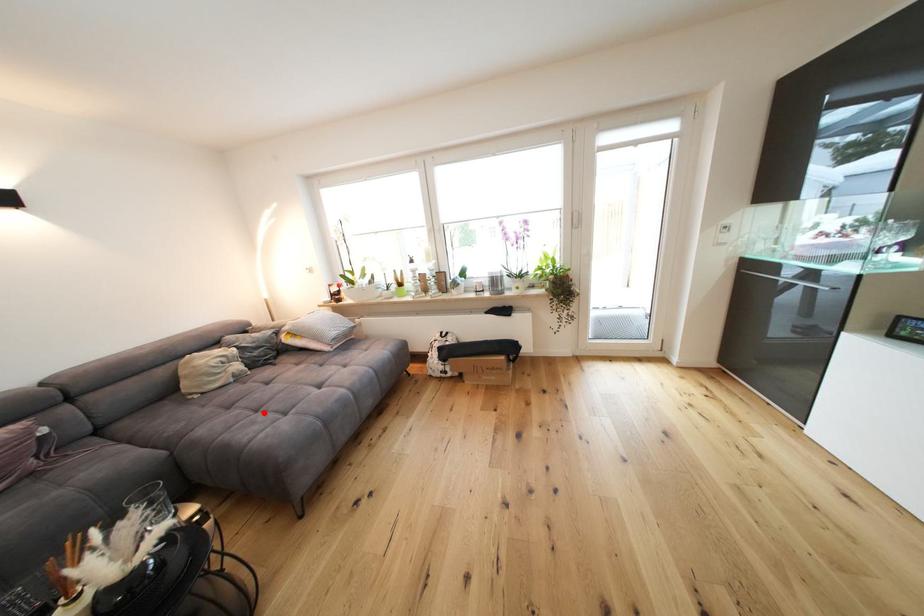
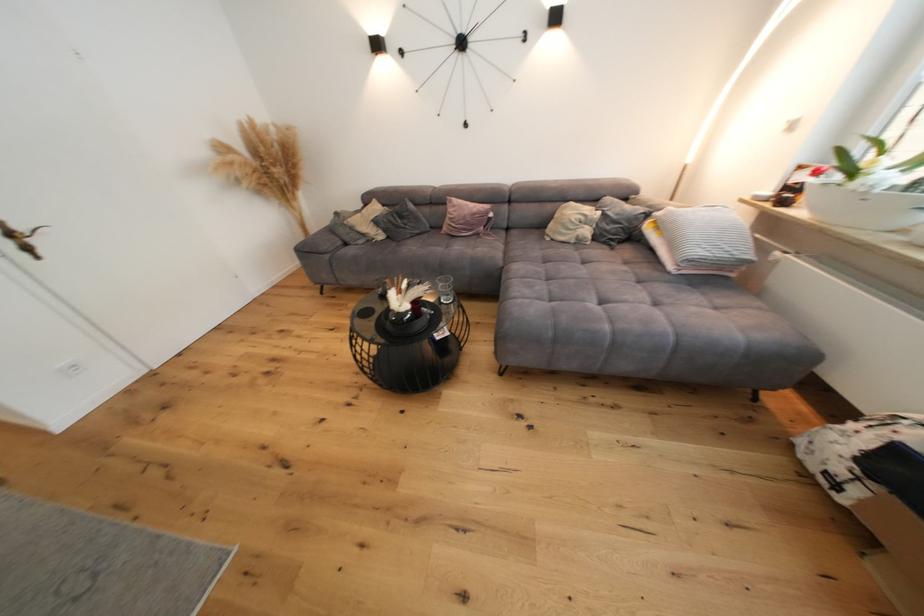
Question: I am providing you with two images of the same scene from different viewpoints. A red point is marked on the first image. At the location where the point appears in image 1, is it still visible in image 2?

Choices:
 (A) Yes
 (B) No

Answer: (A)